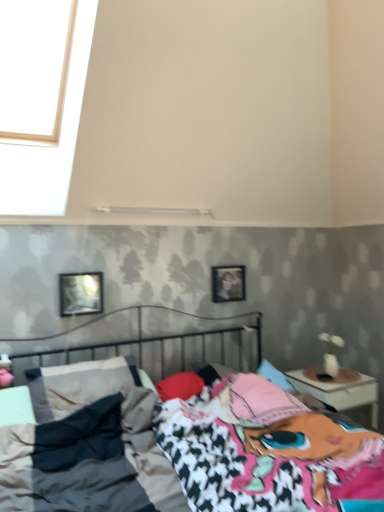
Question: Based on their positions, is metallic reflective picture frame at upper left, the 2th picture frame viewed from the back, located to the left or right of metallic bed at center?

Choices:
 (A) left
 (B) right

Answer: (A)

Question: Is metallic reflective picture frame at upper left, the second picture frame from the right, wider or thinner than metallic bed at center?

Choices:
 (A) wide
 (B) thin

Answer: (B)

Question: Estimate the real-world distances between objects in this image. Which object is farther from the metallic reflective picture frame at upper left, the second picture frame from the right?

Choices:
 (A) metallic bed at center
 (B) white glossy nightstand at right
 (C) wooden frame at center, placed as the first picture frame when sorted from back to front

Answer: (B)

Question: Which object is the closest to the white glossy nightstand at right?

Choices:
 (A) metallic reflective picture frame at upper left, marked as the 1th picture frame in a left-to-right arrangement
 (B) wooden frame at center, which ranks as the second picture frame in front-to-back order
 (C) metallic bed at center

Answer: (B)